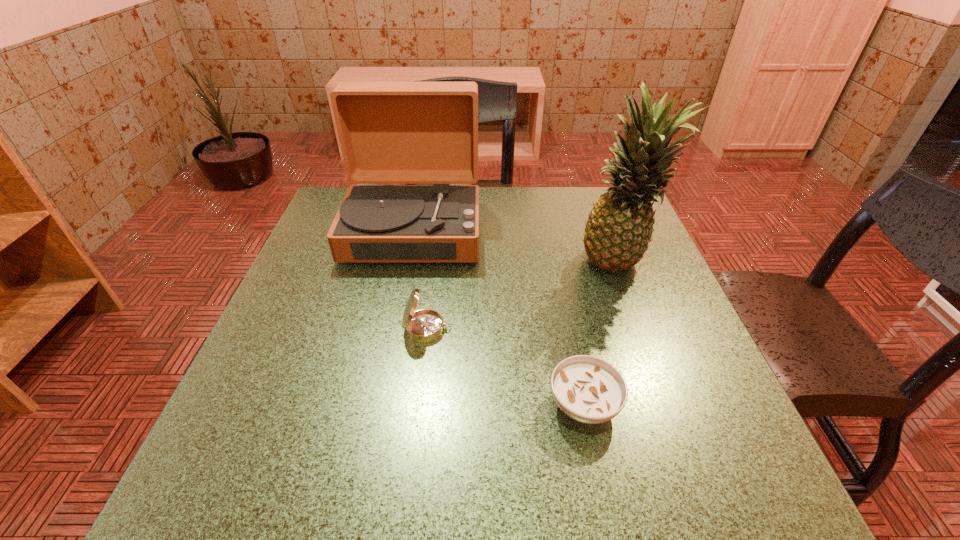
Identify the location of the tallest object. (619, 227).

What are the coordinates of `phonograph record` in the screenshot? It's located at (390, 132).

Where is `the third farthest object`? the third farthest object is located at coordinates (425, 325).

Where is `compass`? compass is located at coordinates (425, 325).

The image size is (960, 540). Identify the location of soup bowl. (588, 389).

Image resolution: width=960 pixels, height=540 pixels. I want to click on the nearest object, so coord(588,389).

Identify the location of vacant space located 0.210m on the front of the pineapple. (660, 374).

At what (x,y) coordinates should I click in order to perform the action: click on free location located on the face of the third shortest object. Please return your answer as a coordinate pair (x, y). Looking at the image, I should click on (382, 386).

At what (x,y) coordinates should I click in order to perform the action: click on free point located 0.060m with the dial facing the second shortest object. Please return your answer as a coordinate pair (x, y). Image resolution: width=960 pixels, height=540 pixels. Looking at the image, I should click on click(x=482, y=328).

Image resolution: width=960 pixels, height=540 pixels. Identify the location of free space located on the left of the soup bowl. (421, 405).